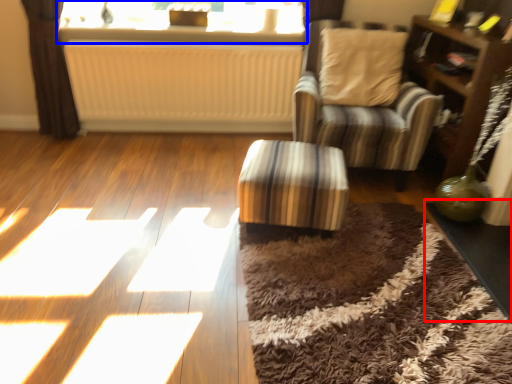
Question: Which point is further to the camera, table (highlighted by a red box) or window (highlighted by a blue box)?

Choices:
 (A) table
 (B) window

Answer: (B)